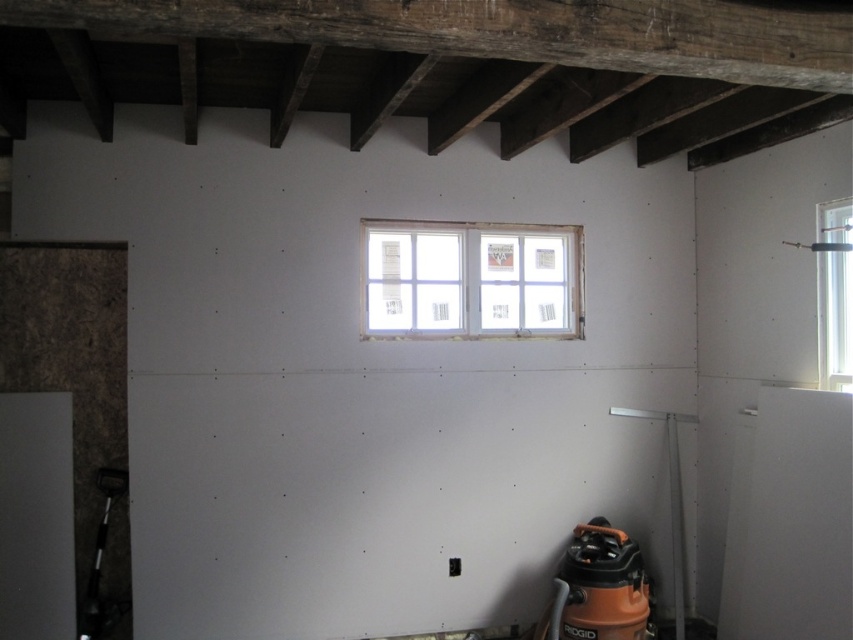
You are a construction worker who needs to access the clear glass window at upper right for repairs. However, there is another clear glass window at upper center in the way. Based on the scene description, can you determine which window you should move first to reach the one you need?

The clear glass window at upper right is behind the clear glass window at upper center, so you should move the clear glass window at upper center first to access the one behind it.

You are standing in the construction area and want to move closer to the vacuum cleaner. There are two points marked in the scene. Which point is closer to you, point at coordinates (x=653, y=637) or point at coordinates (x=817, y=304)?

Point at coordinates (x=817, y=304) is closer to you because it is less further to the camera than point at coordinates (x=653, y=637).